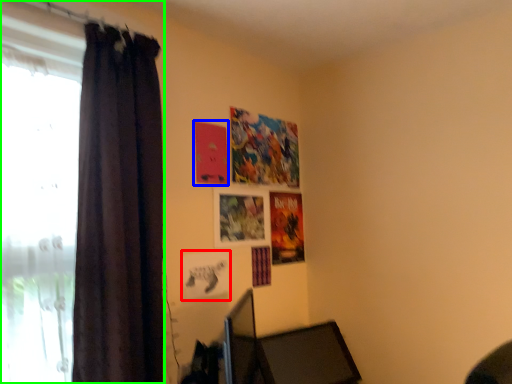
Question: Based on their relative distances, which object is farther from picture frame (highlighted by a red box)? Choose from poster page (highlighted by a blue box) and curtain (highlighted by a green box).

Choices:
 (A) poster page
 (B) curtain

Answer: (B)